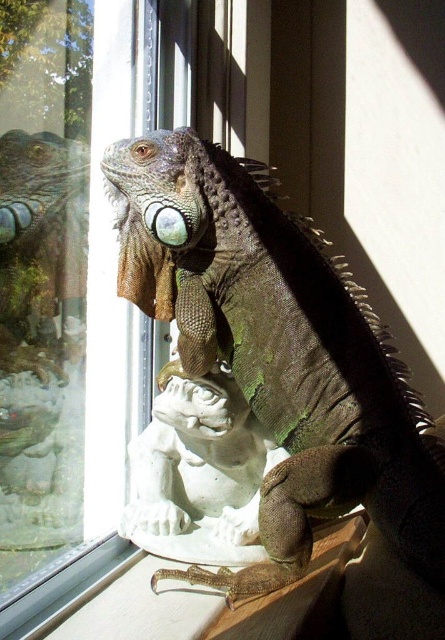
You are standing in a room with a large iguana on a frog sculpture. You notice a point marked at coordinates (77, 280). What object is located at that point?

The point at (77, 280) marks the clear glass window at center.

You are a small insect flying near the clear glass window at center and the green scaly lizard at center. Which object is closer to the ground?

The green scaly lizard at center is closer to the ground because the clear glass window at center is above it.